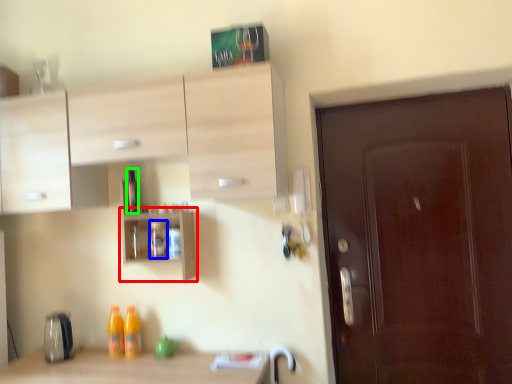
Question: Which object is the farthest from shelf (highlighted by a red box)? Choose among these: bottle (highlighted by a blue box) or bottle (highlighted by a green box).

Choices:
 (A) bottle
 (B) bottle

Answer: (B)